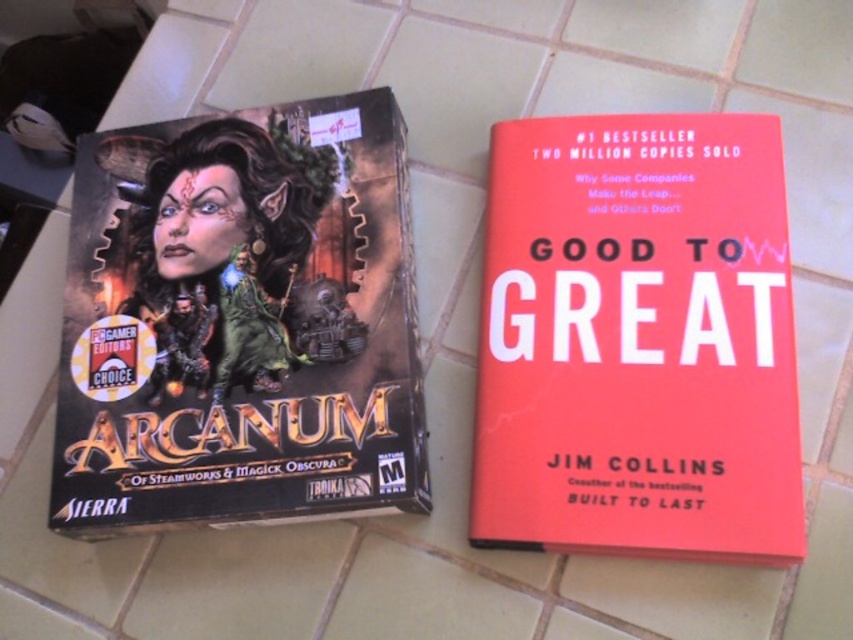
You are standing in front of the tiled surface with the video game box and need to place a small object. Which point, point (364, 99) or point (502, 422), is closer to you?

Point (364, 99) is closer to you because it is further to the camera than point (502, 422).